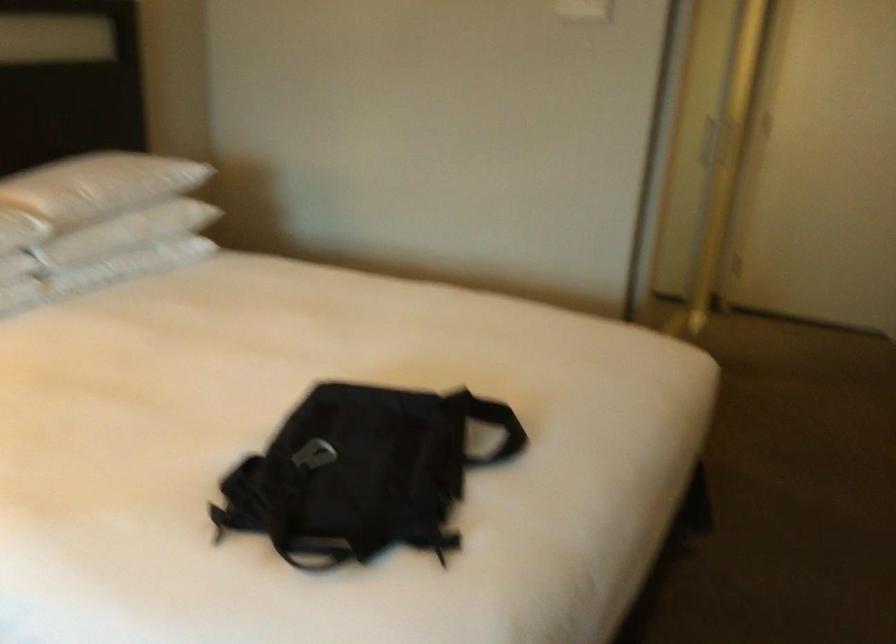
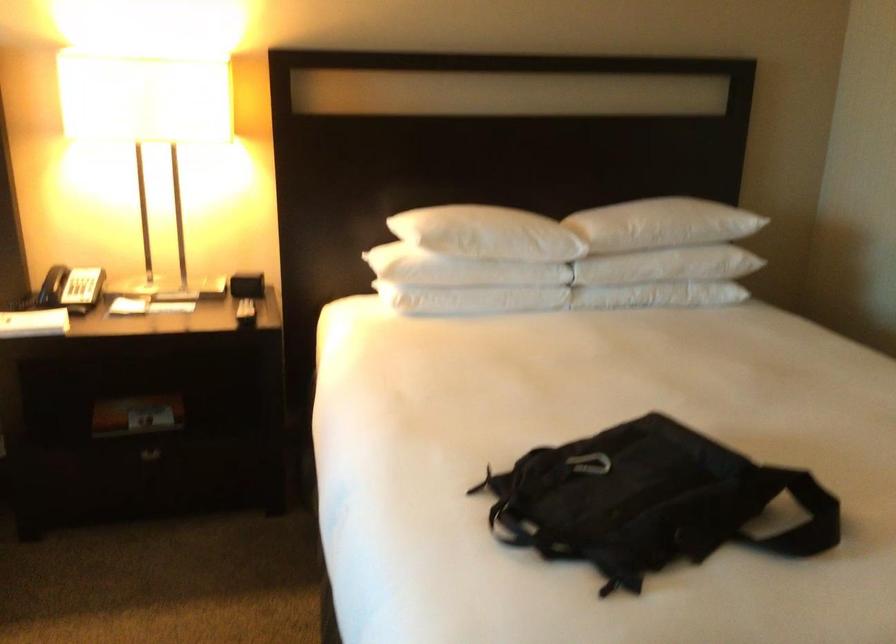
The point at (515, 431) is marked in the first image. Where is the corresponding point in the second image?

(811, 527)